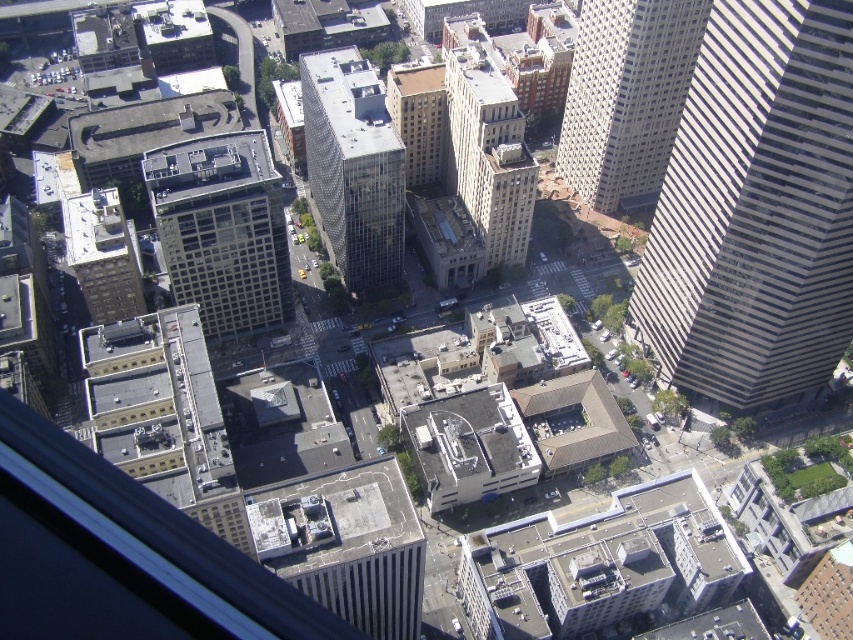
Question: Where is white glass skyscraper at right located in relation to matte glass skyscraper at center in the image?

Choices:
 (A) left
 (B) right

Answer: (B)

Question: Is white glass skyscraper at right thinner than brown brick building at center?

Choices:
 (A) yes
 (B) no

Answer: (B)

Question: Which object is positioned closest to the white glass skyscraper at right?

Choices:
 (A) brown glass building at center
 (B) glassy reflective skyscraper at upper right
 (C) clear glass skyscraper at center
 (D) brown brick building at center

Answer: (B)

Question: Which object is farther from the camera taking this photo?

Choices:
 (A) matte glass skyscraper at center
 (B) brown brick building at left
 (C) brown glass building at center

Answer: (C)

Question: Which object is farther from the camera taking this photo?

Choices:
 (A) brown brick building at left
 (B) glassy reflective skyscraper at upper right

Answer: (B)

Question: Can you confirm if clear glass skyscraper at center is bigger than brown glass building at center?

Choices:
 (A) no
 (B) yes

Answer: (B)